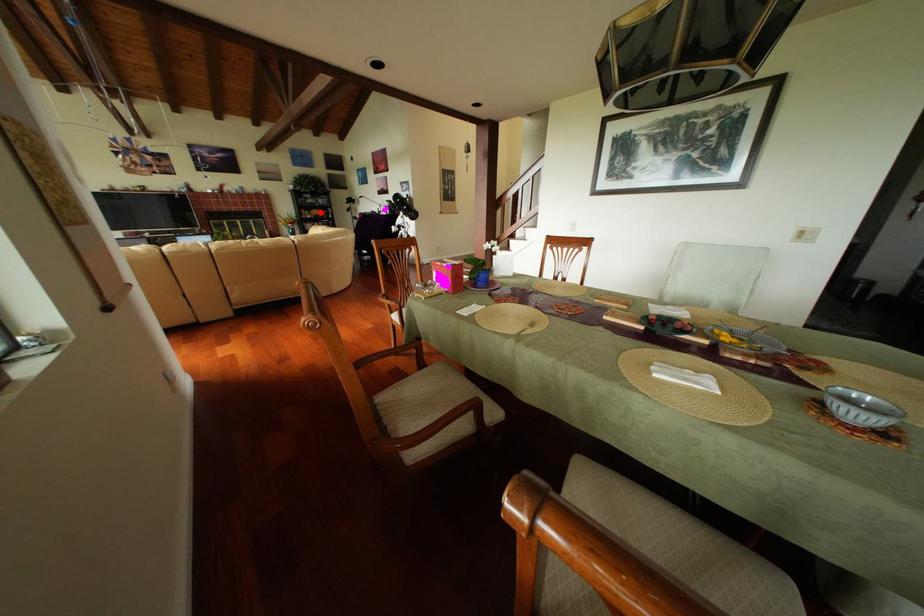
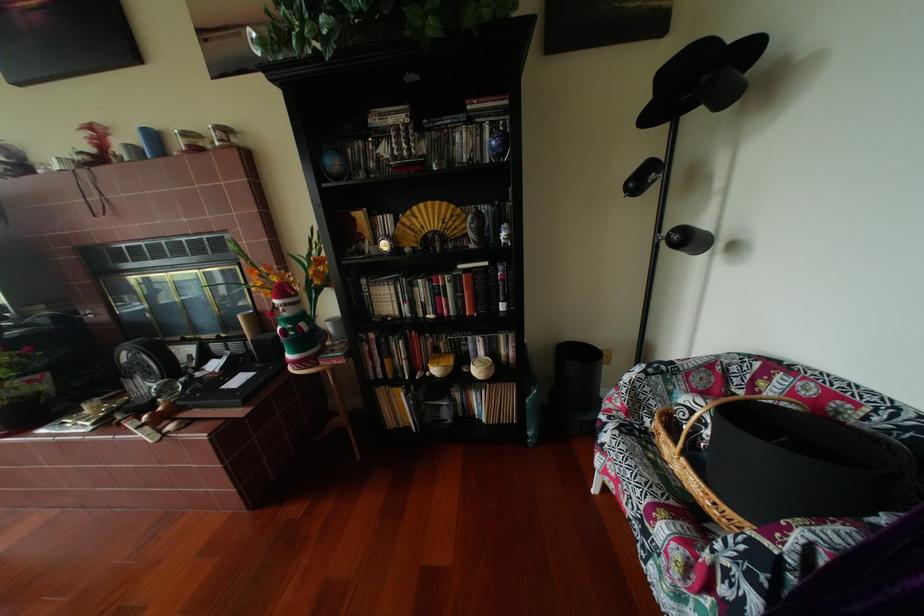
Question: A red point is marked in image1. In image2, is the corresponding 3D point closer to the camera or farther? Reply with the corresponding letter.

Choices:
 (A) The corresponding 3D point is closer.
 (B) The corresponding 3D point is farther.

Answer: (B)